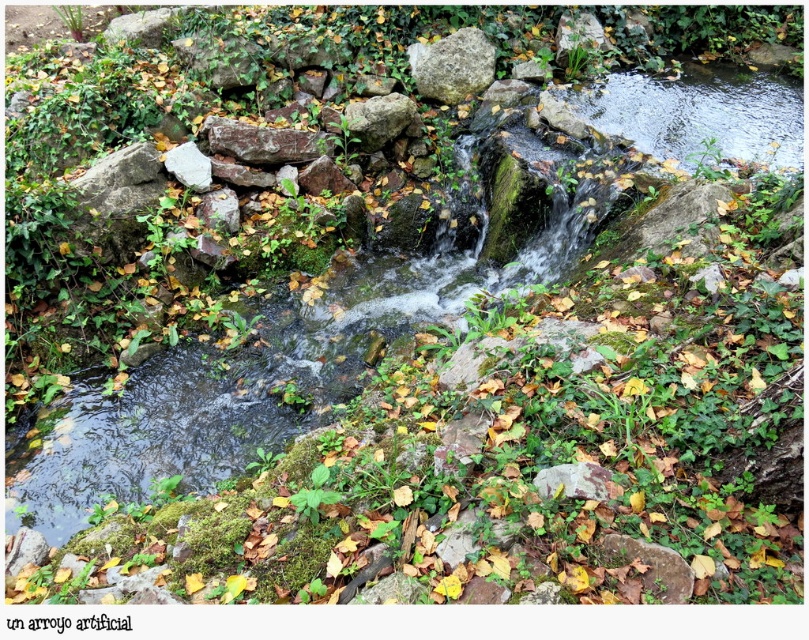
Which is behind, point (481, 86) or point (409, 113)?

Positioned behind is point (481, 86).

Does point (464, 77) lie behind point (359, 106)?

Yes, it is.

The width and height of the screenshot is (809, 640). Find the location of `speckled gray rock at upper center`. speckled gray rock at upper center is located at coordinates (x=452, y=65).

Who is taller, speckled gray rock at upper center or rusty metallic rock at center?

With more height is speckled gray rock at upper center.

Is point (426, 90) positioned before point (257, 148)?

No, it is not.

Is point (454, 52) closer to viewer compared to point (234, 147)?

No, it is behind (234, 147).

The height and width of the screenshot is (640, 809). I want to click on speckled gray rock at upper center, so click(x=452, y=65).

Consider the image. Can you confirm if speckled gray rock at upper center is positioned to the left of speckled gray rock at center?

Indeed, speckled gray rock at upper center is positioned on the left side of speckled gray rock at center.

Is point (413, 44) farther from viewer compared to point (553, 468)?

Yes, it is behind point (553, 468).

Locate an element on the screen. This screenshot has width=809, height=640. speckled gray rock at upper center is located at coordinates (452, 65).